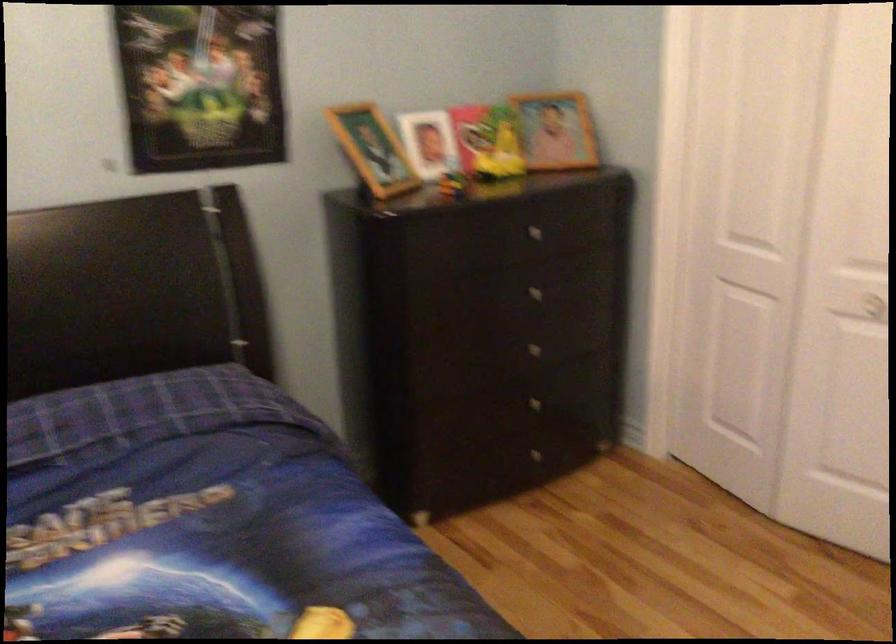
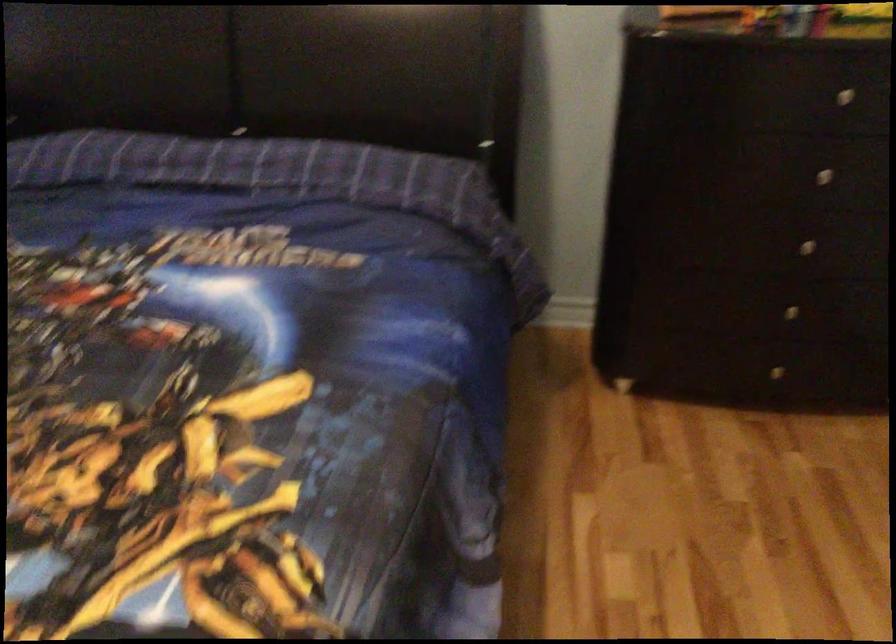
Find the pixel in the second image that matches point 540,285 in the first image.

(833, 169)